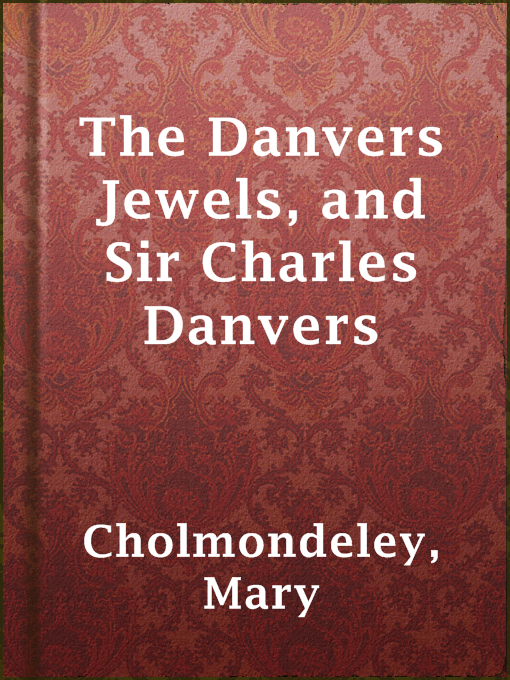
Locate an element on the screen. book is located at coordinates (278, 94).